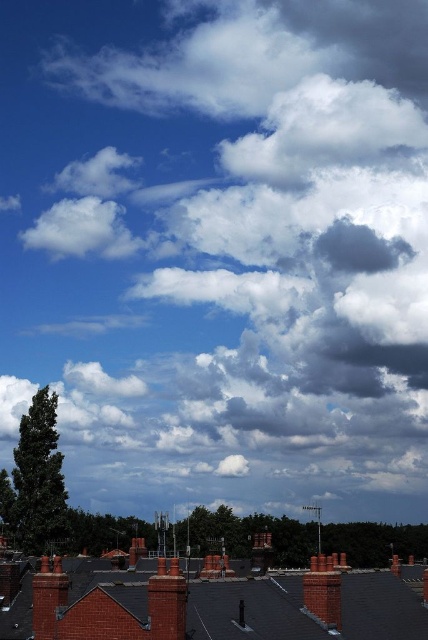
Can you confirm if red brick roof at lower left is bigger than red brick chimney at center?

Indeed, red brick roof at lower left has a larger size compared to red brick chimney at center.

Who is more forward, [376,632] or [171,564]?

Point [171,564] is more forward.

Between point (368, 580) and point (151, 632), which one is positioned in front?

Point (151, 632)

The image size is (428, 640). In order to click on red brick roof at lower left in this screenshot , I will do `click(216, 609)`.

Is red brick chimney at center to the left of red brick chimney at lower left from the viewer's perspective?

In fact, red brick chimney at center is to the right of red brick chimney at lower left.

Who is taller, red brick chimney at center or red brick chimney at lower left?

red brick chimney at lower left

Does point (184, 588) come in front of point (44, 612)?

Yes.

The width and height of the screenshot is (428, 640). Identify the location of red brick chimney at center. (166, 602).

Does brick chimney at center have a larger size compared to red brick chimney at lower left?

Incorrect, brick chimney at center is not larger than red brick chimney at lower left.

Is point (326, 561) farther from camera compared to point (53, 636)?

That is True.

Is point (338, 602) positioned behind point (44, 563)?

Yes, it is.

The width and height of the screenshot is (428, 640). I want to click on brick chimney at center, so click(x=323, y=593).